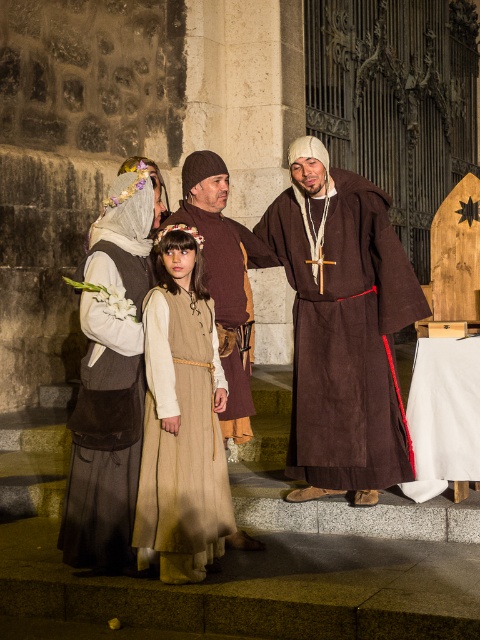
Question: Is brown suede robe at center closer to camera compared to matte brown vest at center?

Choices:
 (A) yes
 (B) no

Answer: (B)

Question: Is matte brown vest at center bigger than brown leather tunic at center?

Choices:
 (A) no
 (B) yes

Answer: (A)

Question: Which point is closer to the camera?

Choices:
 (A) (95, 412)
 (B) (300, 371)
 (C) (237, 433)
 (D) (158, 332)

Answer: (D)

Question: Is beige fabric dress at center bigger than brown leather tunic at center?

Choices:
 (A) yes
 (B) no

Answer: (B)

Question: Which object is closer to the camera taking this photo?

Choices:
 (A) brown suede robe at center
 (B) brown leather tunic at center
 (C) matte brown vest at center

Answer: (C)

Question: Which of the following is the farthest from the observer?

Choices:
 (A) click(x=299, y=250)
 (B) click(x=189, y=202)
 (C) click(x=131, y=394)

Answer: (B)